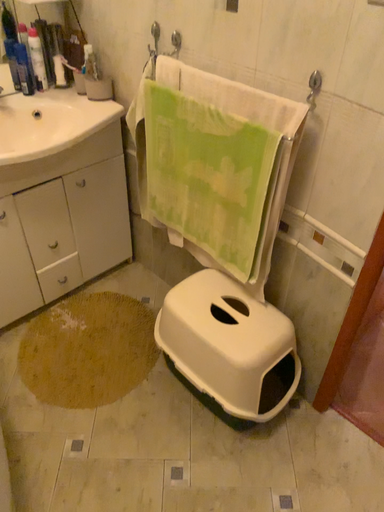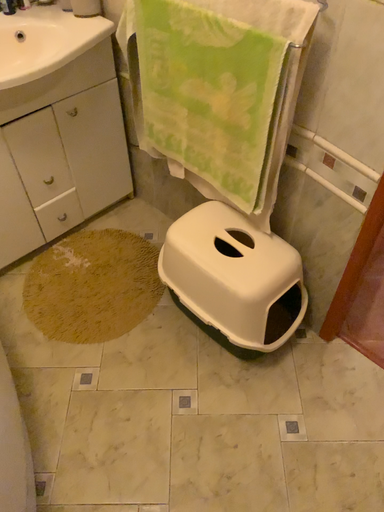
Question: How did the camera likely rotate when shooting the video?

Choices:
 (A) rotated downward
 (B) rotated upward

Answer: (A)